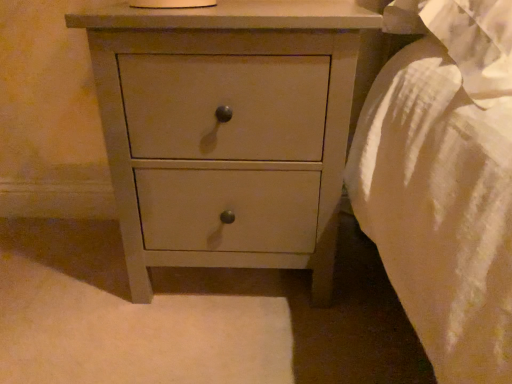
Locate an element on the screen. matte white chest of drawers at center is located at coordinates (230, 126).

What do you see at coordinates (230, 126) in the screenshot? I see `matte white chest of drawers at center` at bounding box center [230, 126].

In order to face matte white chest of drawers at center, should I rotate leftwards or rightwards?

Rotate your view left by about 3.179°.

At what (x,y) coordinates should I click in order to perform the action: click on matte white chest of drawers at center. Please return your answer as a coordinate pair (x, y). The height and width of the screenshot is (384, 512). Looking at the image, I should click on (230, 126).